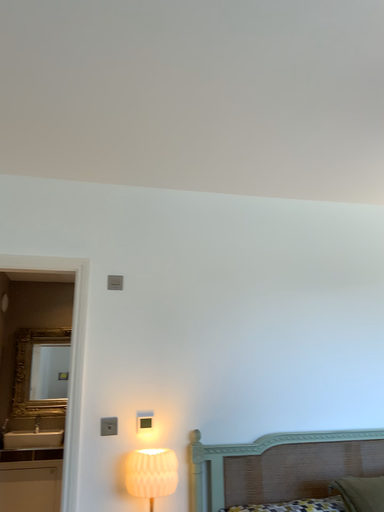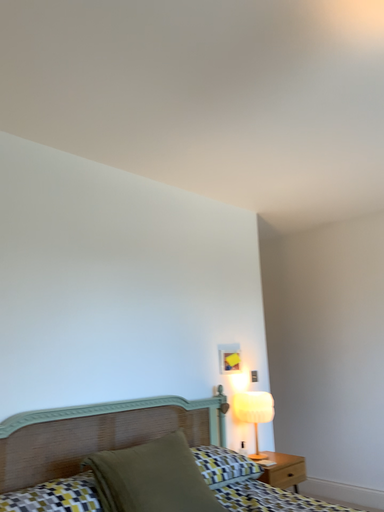
Question: How did the camera likely rotate when shooting the video?

Choices:
 (A) rotated right
 (B) rotated left

Answer: (A)